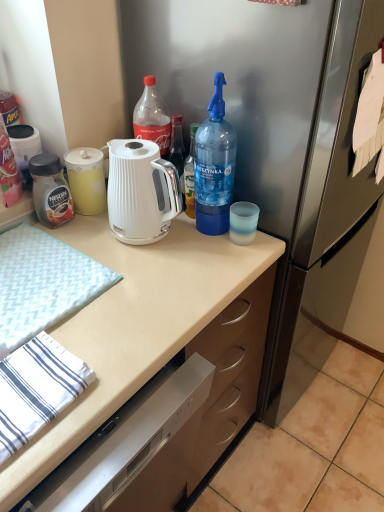
Identify the location of free location to the right of matte black jar at left, the 2th bottle from the right. (102, 234).